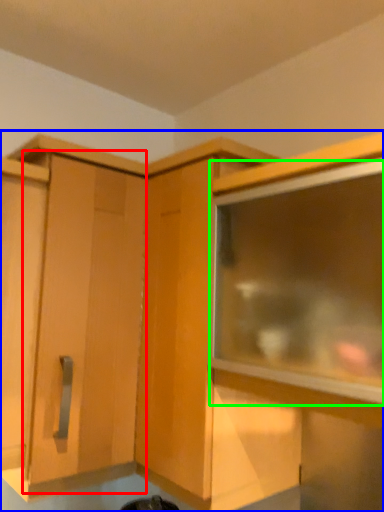
Question: Which object is the farthest from cabinetry (highlighted by a red box)? Choose among these: cabinetry (highlighted by a blue box) or window (highlighted by a green box).

Choices:
 (A) cabinetry
 (B) window

Answer: (B)